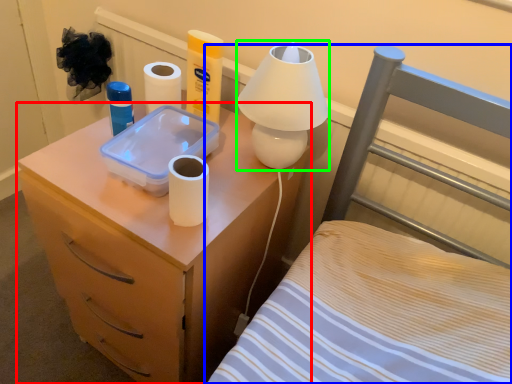
Question: Considering the real-world distances, which object is farthest from nightstand (highlighted by a red box)? furniture (highlighted by a blue box) or table lamp (highlighted by a green box)?

Choices:
 (A) furniture
 (B) table lamp

Answer: (B)